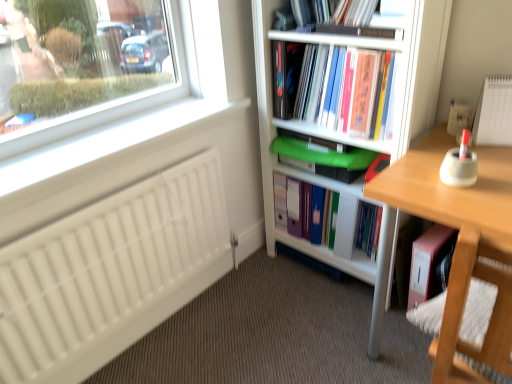
Question: From a real-world perspective, is wooden swivel chair at lower right physically located above or below pink matte folder at lower right, placed as the 1th book when sorted from bottom to top?

Choices:
 (A) below
 (B) above

Answer: (B)

Question: From the image's perspective, is wooden swivel chair at lower right located above or below pink matte folder at lower right, placed as the 1th book when sorted from bottom to top?

Choices:
 (A) above
 (B) below

Answer: (B)

Question: Considering the real-world distances, which object is closest to the white matte radiator at lower left?

Choices:
 (A) white plastic bookcase at center
 (B) matte plastic shelf at center
 (C) green plastic tray at center, the 3th book viewed from the top
 (D) wooden swivel chair at lower right
 (E) hardcover book at upper center, the 5th book ordered from the bottom

Answer: (C)

Question: Estimate the real-world distances between objects in this image. Which object is closer to the pink matte folder at lower right, placed as the 1th book when sorted from bottom to top?

Choices:
 (A) green plastic tray at center, the 3th book viewed from the top
 (B) green plastic folder at center, the fourth book from the top
 (C) hardcover book at upper center, the 1th book in the top-to-bottom sequence
 (D) hardcover book at upper center
 (E) white matte radiator at lower left

Answer: (B)